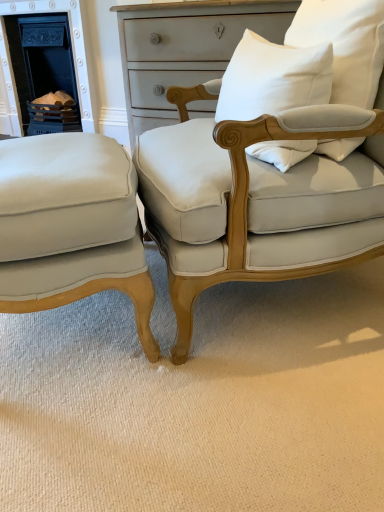
Question: From a real-world perspective, is matte black fireplace at left positioned above or below white cotton pillow at upper right, placed as the first pillow when sorted from left to right?

Choices:
 (A) below
 (B) above

Answer: (A)

Question: Considering the positions of matte black fireplace at left and white cotton pillow at upper right, placed as the first pillow when sorted from left to right, in the image, is matte black fireplace at left bigger or smaller than white cotton pillow at upper right, placed as the first pillow when sorted from left to right,?

Choices:
 (A) small
 (B) big

Answer: (B)

Question: Considering the real-world distances, which object is farthest from the white cotton pillow at upper right, which ranks as the first pillow in right-to-left order?

Choices:
 (A) white cotton pillow at upper right, marked as the 2th pillow in a right-to-left arrangement
 (B) matte cream fabric chair at lower left, the 2th chair when ordered from right to left
 (C) matte white fabric chair at center, marked as the 2th chair in a left-to-right arrangement
 (D) matte black fireplace at left

Answer: (D)

Question: Considering the real-world distances, which object is farthest from the matte cream fabric chair at lower left, the first chair when ordered from left to right?

Choices:
 (A) white cotton pillow at upper right, marked as the 2th pillow in a right-to-left arrangement
 (B) matte white fabric chair at center, marked as the 2th chair in a left-to-right arrangement
 (C) white cotton pillow at upper right, which ranks as the first pillow in right-to-left order
 (D) matte black fireplace at left

Answer: (D)